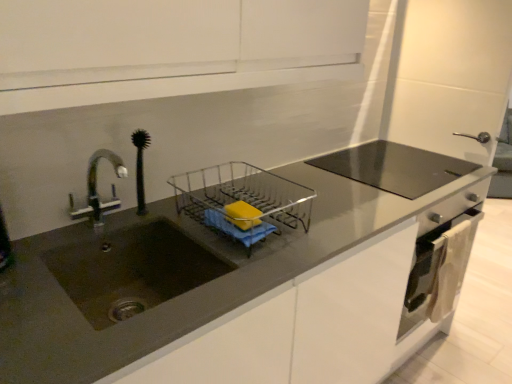
Question: Does matte gray countertop at center have a lesser width compared to matte dark brown sink at left?

Choices:
 (A) yes
 (B) no

Answer: (B)

Question: Is matte dark brown sink at left inside matte gray countertop at center?

Choices:
 (A) no
 (B) yes

Answer: (B)

Question: Is matte gray countertop at center shorter than matte dark brown sink at left?

Choices:
 (A) no
 (B) yes

Answer: (A)

Question: Would you say matte gray countertop at center is a long distance from matte dark brown sink at left?

Choices:
 (A) no
 (B) yes

Answer: (A)

Question: Can you confirm if matte gray countertop at center is bigger than matte dark brown sink at left?

Choices:
 (A) yes
 (B) no

Answer: (A)

Question: Is matte gray countertop at center not inside matte dark brown sink at left?

Choices:
 (A) yes
 (B) no

Answer: (A)

Question: Can you confirm if matte dark brown sink at left is thinner than satin silver oven at lower right?

Choices:
 (A) yes
 (B) no

Answer: (B)

Question: From the image's perspective, would you say matte dark brown sink at left is shown under satin silver oven at lower right?

Choices:
 (A) yes
 (B) no

Answer: (B)

Question: From the image's perspective, would you say matte dark brown sink at left is positioned over satin silver oven at lower right?

Choices:
 (A) no
 (B) yes

Answer: (B)

Question: Can you confirm if matte dark brown sink at left is shorter than satin silver oven at lower right?

Choices:
 (A) no
 (B) yes

Answer: (B)

Question: Is matte dark brown sink at left taller than satin silver oven at lower right?

Choices:
 (A) no
 (B) yes

Answer: (A)

Question: Is matte dark brown sink at left at the left side of satin silver oven at lower right?

Choices:
 (A) yes
 (B) no

Answer: (A)

Question: Does clear plastic dish rack at center turn towards yellow matte soap at center?

Choices:
 (A) yes
 (B) no

Answer: (A)